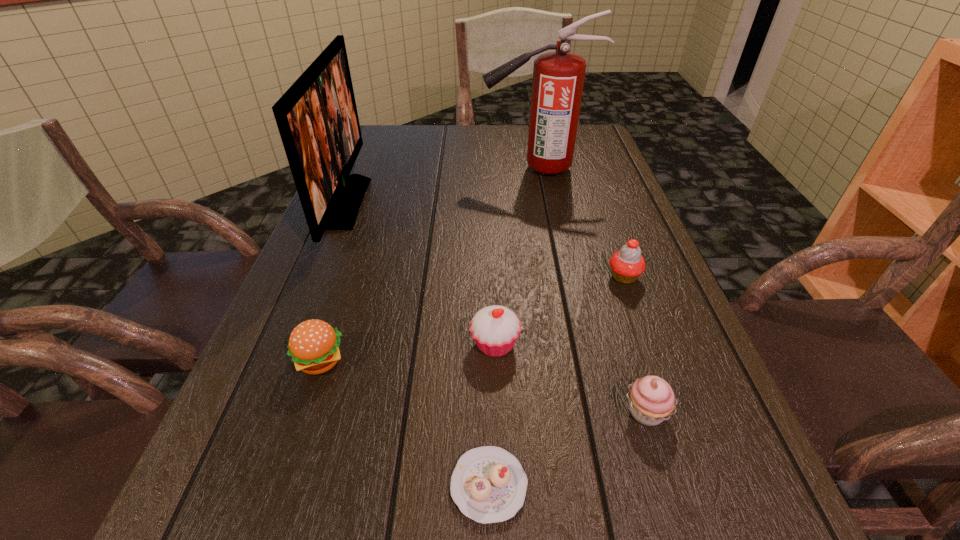
What are the coordinates of `empty space between the hamburger and the second farthest cupcake` in the screenshot? It's located at (408, 353).

Where is `free space between the farthest cupcake and the hamburger`? free space between the farthest cupcake and the hamburger is located at coordinates (472, 319).

You are a GUI agent. You are given a task and a screenshot of the screen. Output one action in this format:
    pyautogui.click(x=<x>, y=<y>)
    Task: Click on the vacant region between the farthest cupcake and the second nearest cupcake
    The width and height of the screenshot is (960, 540).
    Given the screenshot: What is the action you would take?
    pyautogui.click(x=635, y=345)

Find the location of a particular element. The image size is (960, 540). vacant region between the farthest cupcake and the third tallest cupcake is located at coordinates (635, 345).

Locate an element on the screen. object that is the sixth closest to the fire extinguisher is located at coordinates (488, 484).

Find the location of a particular element. The height and width of the screenshot is (540, 960). object that is the fifth closest to the nearest object is located at coordinates (317, 119).

This screenshot has height=540, width=960. Find the location of `the fourth closest cupcake to the hamburger`. the fourth closest cupcake to the hamburger is located at coordinates (627, 264).

I want to click on cupcake that is the third nearest to the monitor, so click(x=627, y=264).

Find the location of a particular element. The image size is (960, 540). vacant space that satisfies the following two spatial constraints: 1. on the front-facing side of the monitor; 2. on the back side of the sixth farthest object is located at coordinates (259, 412).

Where is `vacant space that satisfies the following two spatial constraints: 1. at the nozzle of the tallest object; 2. on the left side of the farthest cupcake`? vacant space that satisfies the following two spatial constraints: 1. at the nozzle of the tallest object; 2. on the left side of the farthest cupcake is located at coordinates (558, 277).